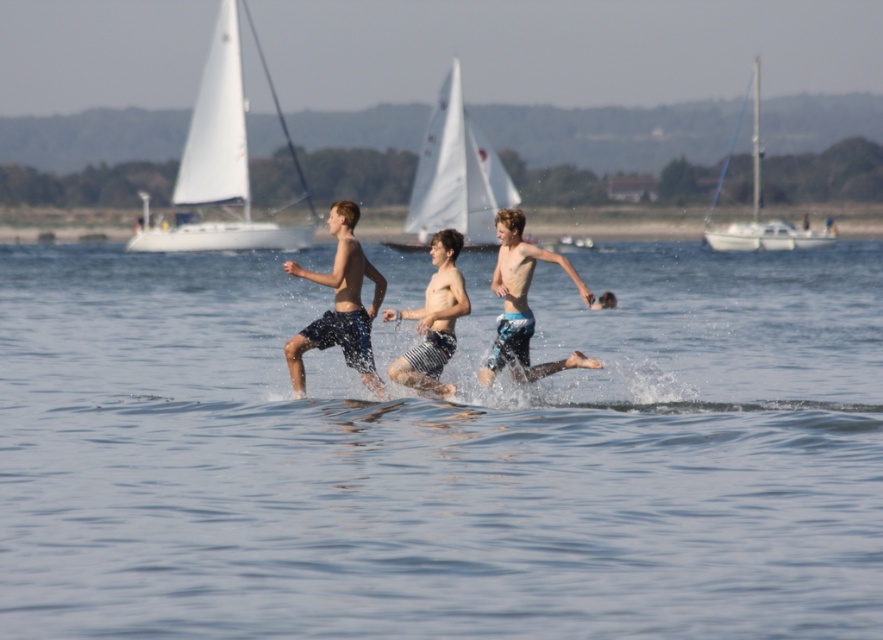
You are a photographer standing at the edge of the water. You want to capture a photo of the blue patterned shorts at center and the white sailboat at right in the same frame. Based on their positions, which object should you focus on first to ensure both are in the frame?

The blue patterned shorts at center is positioned on the left side of white sailboat at right, so you should focus on the blue patterned shorts at center first to ensure both are in the frame.

You are standing at the point with coordinates point (205, 250) and want to reach the point with coordinates point (240, 588). Which direction should you move in to get there?

You should move forward because point (240, 588) is in front of point (205, 250).